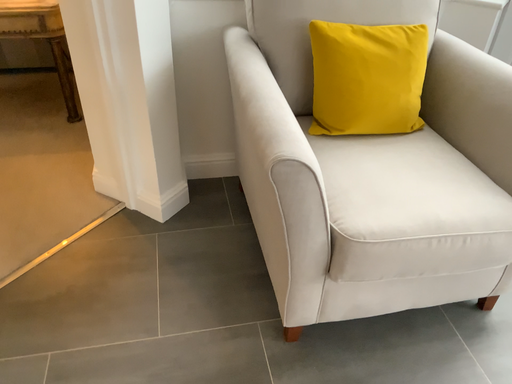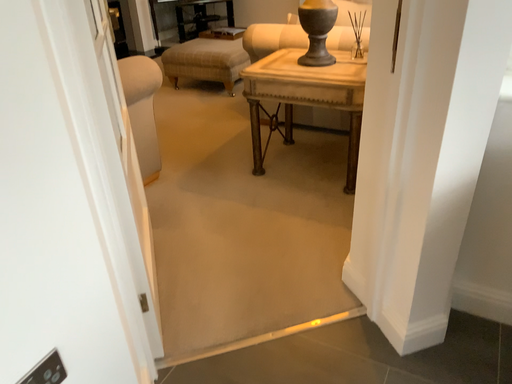
Question: Which way did the camera rotate in the video?

Choices:
 (A) rotated downward
 (B) rotated upward

Answer: (B)